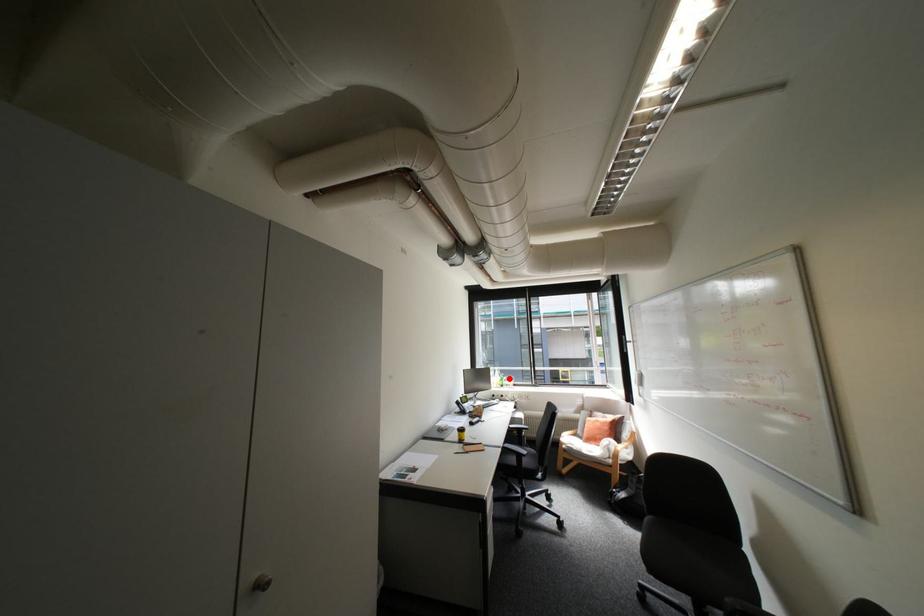
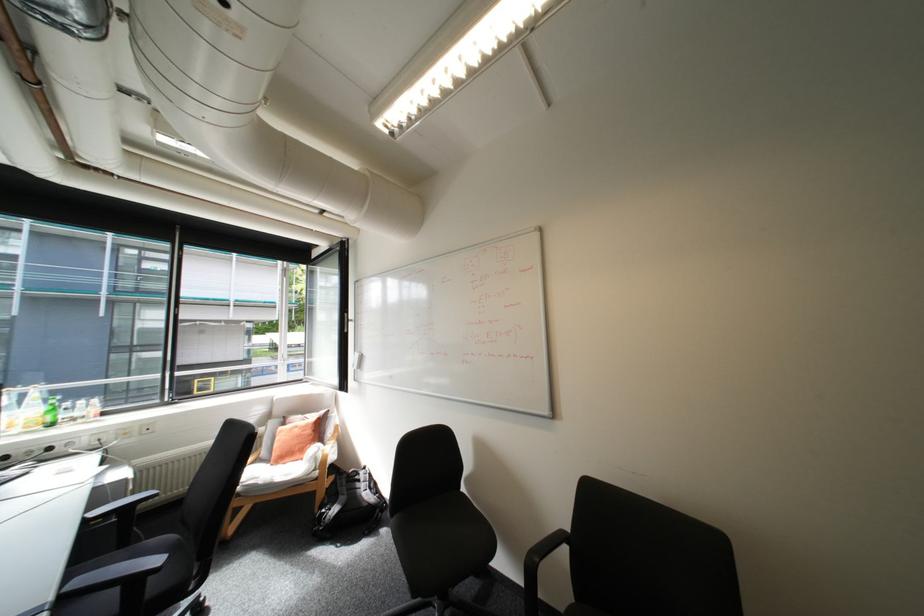
Question: I am providing you with two images of the same scene from different viewpoints. In image1, a red point is highlighted. Considering the same 3D point in image2, which of the following is correct?

Choices:
 (A) It is closer
 (B) It is farther

Answer: (B)